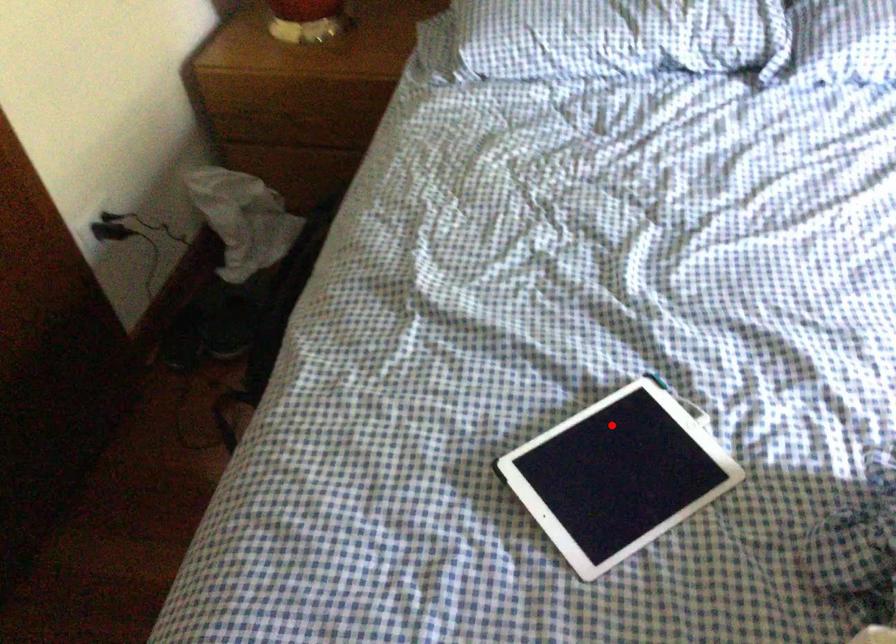
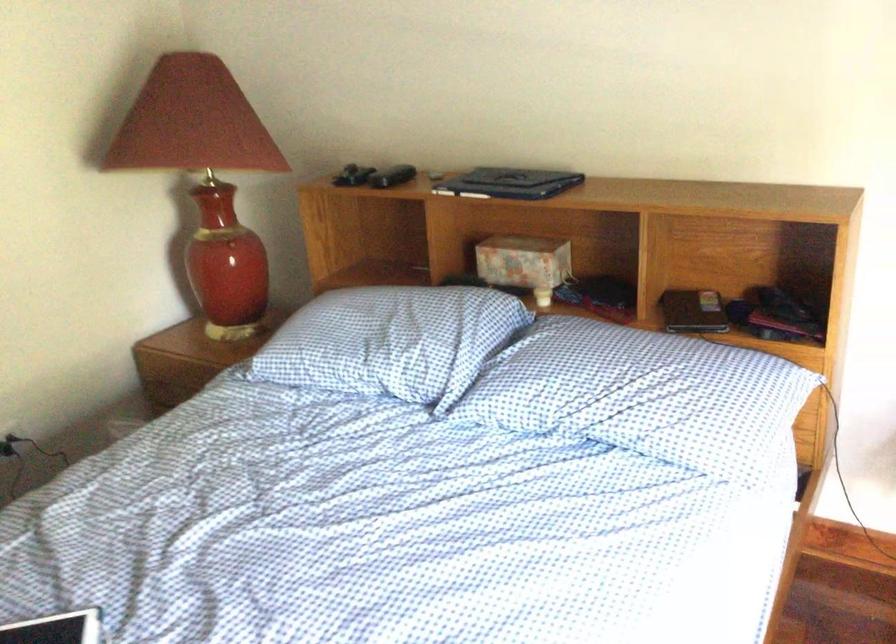
Locate, in the second image, the point that corresponds to the highlighted location in the first image.

(56, 629)